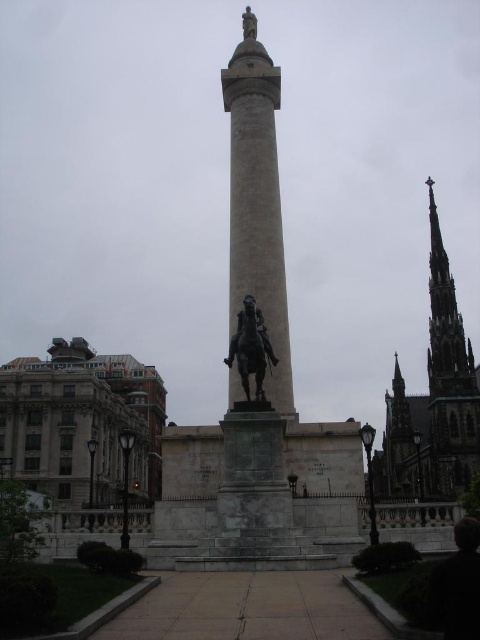
You are an architect visiting the monument and need to determine which object is larger for a scale model. Based on the scene, which is bigger between the dark gray stone spire at right and the bronze statue at center?

The dark gray stone spire at right is bigger than the bronze statue at center according to the description.

You are standing at the entrance of the public square and want to locate the white marble column at center. According to the coordinates provided, where should you look relative to your position?

You should look towards the center of the square, as the white marble column at center is located at coordinates point (256, 200), which corresponds to the central area.

You are a tourist visiting the monument and want to take a photo that includes both the white marble column at center and the bronze statue at center. Since you want to ensure both are clearly visible in the frame, which object should you focus on to make sure both are in focus?

The white marble column at center is bigger than the bronze statue at center, so focusing on the white marble column at center will ensure both are in focus as it is larger and occupies more space in the frame.